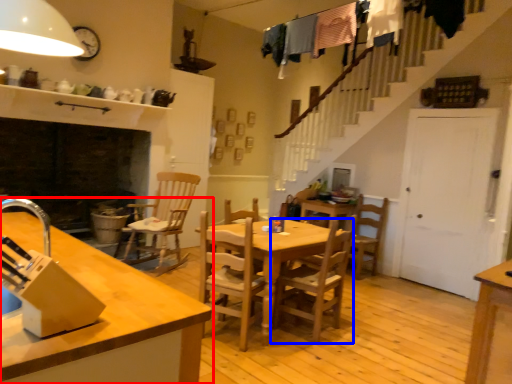
Question: Among these objects, which one is farthest to the camera, countertop (highlighted by a red box) or chair (highlighted by a blue box)?

Choices:
 (A) countertop
 (B) chair

Answer: (B)